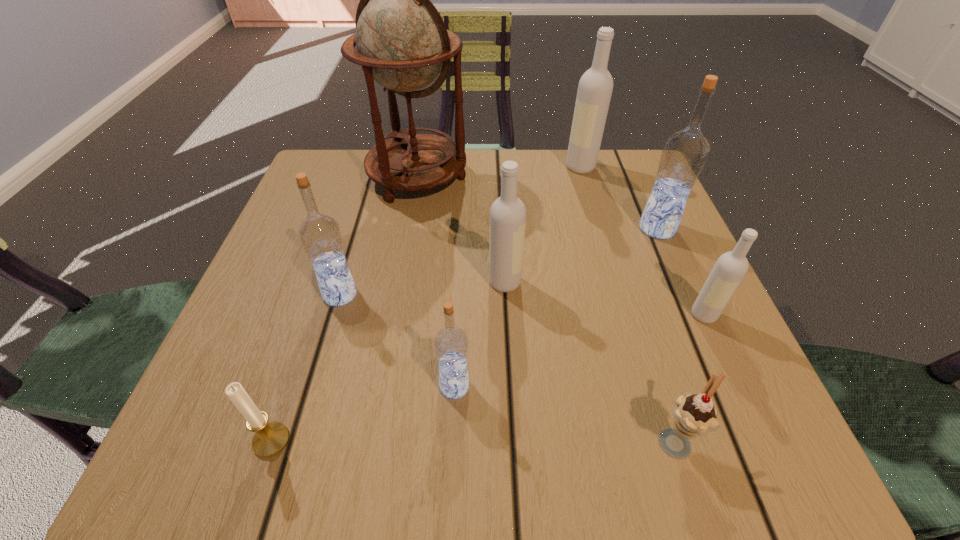
The image size is (960, 540). I want to click on candle holder at the left edge, so click(269, 439).

You are a GUI agent. You are given a task and a screenshot of the screen. Output one action in this format:
    pyautogui.click(x=<x>, y=<y>)
    Task: Click on the icecream present at the right edge
    This screenshot has width=960, height=540.
    Given the screenshot: What is the action you would take?
    pyautogui.click(x=694, y=415)

This screenshot has width=960, height=540. Identify the location of object present at the far left corner. (402, 43).

Where is `object at the near left corner`? The image size is (960, 540). object at the near left corner is located at coordinates (269, 439).

Where is `object that is at the far right corner`? The image size is (960, 540). object that is at the far right corner is located at coordinates (595, 87).

At what (x,y) coordinates should I click in order to perform the action: click on object located at the near right corner. Please return your answer as a coordinate pair (x, y). This screenshot has width=960, height=540. Looking at the image, I should click on (694, 415).

The width and height of the screenshot is (960, 540). In the image, there is a desktop. Identify the location of vacant space at the far edge. (559, 167).

Find the location of a particular element. This screenshot has height=540, width=960. free space at the near edge of the desktop is located at coordinates (317, 446).

The width and height of the screenshot is (960, 540). Find the location of `vacant space at the left edge of the desktop`. vacant space at the left edge of the desktop is located at coordinates (266, 311).

At what (x,y) coordinates should I click in order to perform the action: click on free spot at the right edge of the desktop. Please return your answer as a coordinate pair (x, y). Looking at the image, I should click on (708, 357).